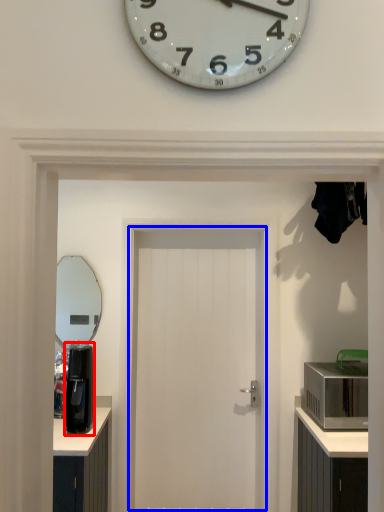
Question: Which point is further to the camera, coffee machine (highlighted by a red box) or door (highlighted by a blue box)?

Choices:
 (A) coffee machine
 (B) door

Answer: (B)